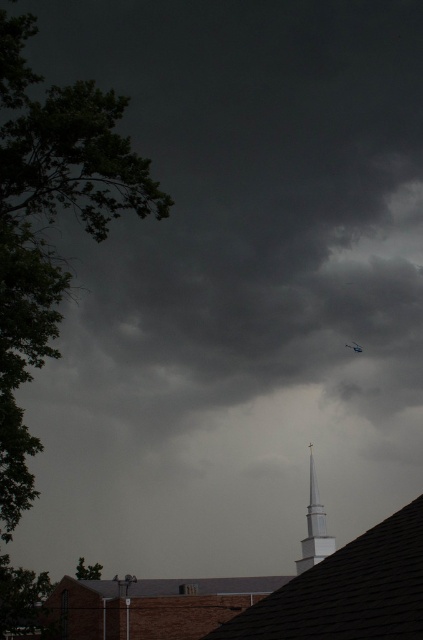
You are a pilot flying a small aircraft and notice the white smooth steeple at center and the blue metallic plane at upper center in the distance. Which object would appear closer to you from your current position?

The white smooth steeple at center appears closer because it is positioned in front of the blue metallic plane at upper center.

You are an architect designing a new building. You observe the white smooth steeple at center and the blue metallic plane at upper center in the image. Which object has a greater width in the scene?

The white smooth steeple at center might be wider than blue metallic plane at upper center according to the description.